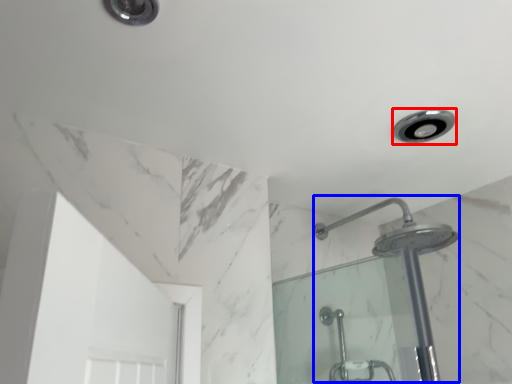
Question: Among these objects, which one is nearest to the camera, light fixture (highlighted by a red box) or shower (highlighted by a blue box)?

Choices:
 (A) light fixture
 (B) shower

Answer: (B)